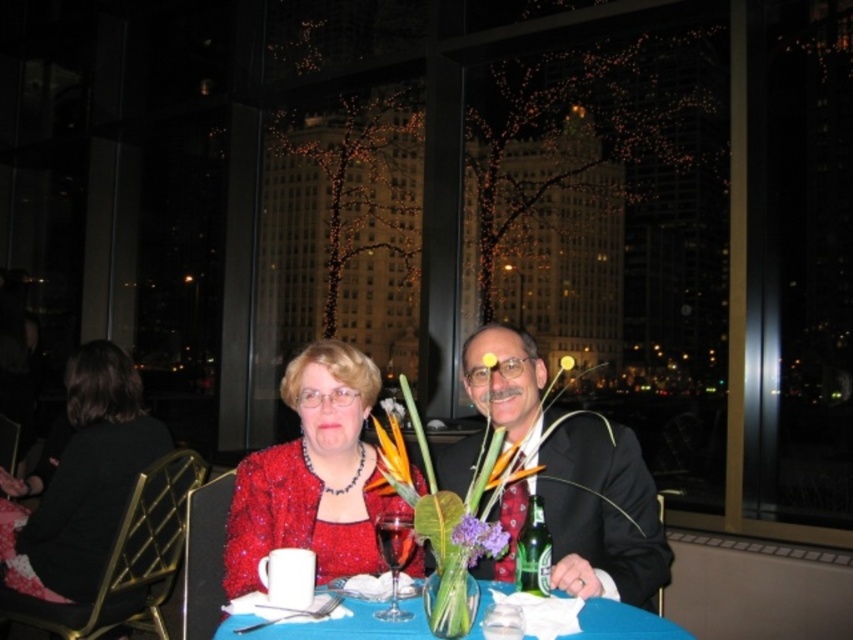
You are a photographer taking a picture of the purple matte flower at center. The camera is set to focus on the point at coordinates point (x=479, y=538). Will the purple matte flower at center be in focus?

Yes, the point (x=479, y=538) corresponds to the purple matte flower at center, so the flower will be in focus.

You are a photographer setting up a photo shoot in this restaurant scene. You need to position a light source so it illuminates both the shiny black suit at center and the matte black dress at left without causing harsh shadows. Considering their heights, which object should be placed closer to the light source?

The shiny black suit at center is shorter than the matte black dress at left, so the light source should be placed closer to the shiny black suit at center to ensure both receive adequate lighting without harsh shadows.